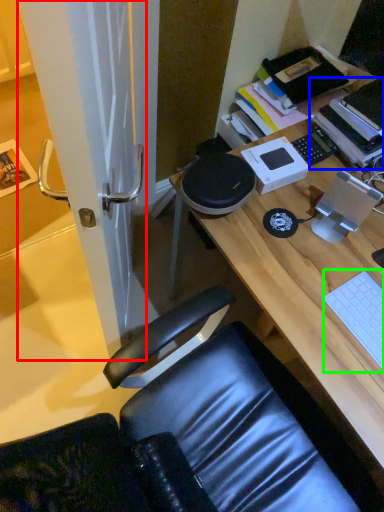
Question: Which object is the farthest from screen door (highlighted by a red box)? Choose among these: book (highlighted by a blue box) or laptop keyboard (highlighted by a green box).

Choices:
 (A) book
 (B) laptop keyboard

Answer: (A)